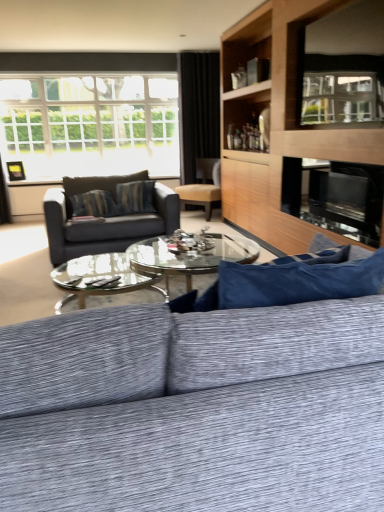
Question: From the image's perspective, is matte black couch at center, arranged as the 2th studio couch when viewed from the front, below white glass window at upper left?

Choices:
 (A) yes
 (B) no

Answer: (A)

Question: Is matte black couch at center, arranged as the 2th studio couch when viewed from the front, far away from white glass window at upper left?

Choices:
 (A) no
 (B) yes

Answer: (B)

Question: From a real-world perspective, is matte black couch at center, marked as the first studio couch in a back-to-front arrangement, located beneath white glass window at upper left?

Choices:
 (A) yes
 (B) no

Answer: (A)

Question: Is matte black couch at center, marked as the first studio couch in a back-to-front arrangement, bigger than white glass window at upper left?

Choices:
 (A) yes
 (B) no

Answer: (B)

Question: Can you confirm if matte black couch at center, arranged as the 2th studio couch when viewed from the front, is shorter than white glass window at upper left?

Choices:
 (A) no
 (B) yes

Answer: (B)

Question: Is point (187, 53) positioned closer to the camera than point (342, 220)?

Choices:
 (A) farther
 (B) closer

Answer: (A)

Question: Is black fabric curtain at upper center to the left or to the right of black glass fireplace at center in the image?

Choices:
 (A) right
 (B) left

Answer: (B)

Question: Is black fabric curtain at upper center inside the boundaries of black glass fireplace at center, or outside?

Choices:
 (A) inside
 (B) outside

Answer: (B)

Question: Is black fabric curtain at upper center in front of or behind black glass fireplace at center in the image?

Choices:
 (A) front
 (B) behind

Answer: (B)

Question: In terms of width, does clear glass window screen at upper right look wider or thinner when compared to black glass fireplace at center?

Choices:
 (A) wide
 (B) thin

Answer: (B)

Question: Is clear glass window screen at upper right taller or shorter than black glass fireplace at center?

Choices:
 (A) tall
 (B) short

Answer: (A)

Question: Considering their positions, is clear glass window screen at upper right located in front of or behind black glass fireplace at center?

Choices:
 (A) behind
 (B) front

Answer: (B)

Question: In the image, is clear glass window screen at upper right on the left side or the right side of black glass fireplace at center?

Choices:
 (A) left
 (B) right

Answer: (A)

Question: Looking at their shapes, would you say black glass fireplace at center is wider or thinner than wooden entertainment center at upper right?

Choices:
 (A) thin
 (B) wide

Answer: (A)

Question: In terms of height, does black glass fireplace at center look taller or shorter compared to wooden entertainment center at upper right?

Choices:
 (A) short
 (B) tall

Answer: (A)